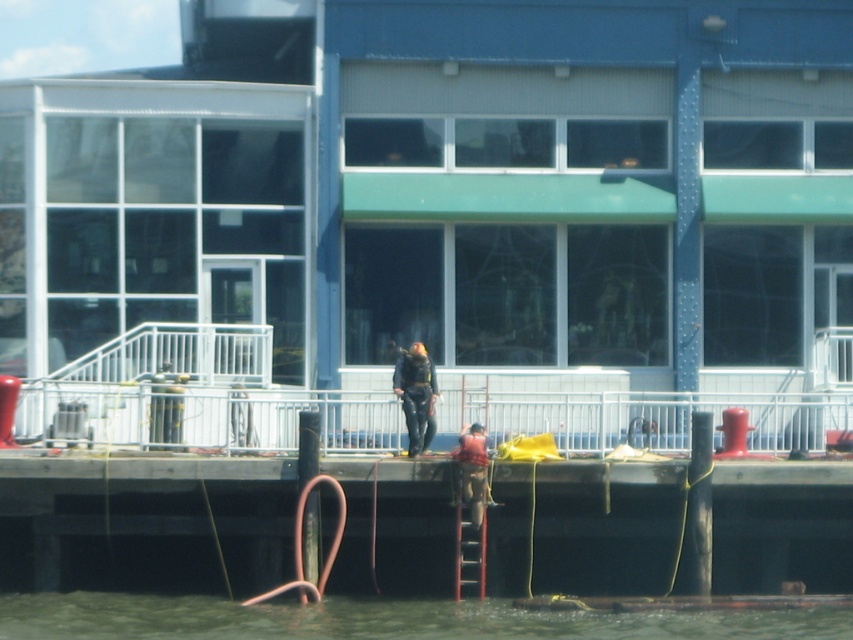
Is metallic red ladder at center above red plaid shirt at center?

No, metallic red ladder at center is not above red plaid shirt at center.

Who is more forward, (486, 499) or (461, 432)?

Point (486, 499)

Identify the location of metallic red ladder at center. (469, 509).

Does greenish water at lower center appear over red plaid shirt at center?

No, greenish water at lower center is not above red plaid shirt at center.

Which is in front, point (12, 628) or point (474, 502)?

Point (12, 628) is in front.

Find the location of a particular element. Image resolution: width=853 pixels, height=640 pixels. greenish water at lower center is located at coordinates (386, 620).

Does point (33, 381) lie behind point (128, 600)?

Yes.

Based on the photo, is white metal railing at center bigger than greenish water at lower center?

Incorrect, white metal railing at center is not larger than greenish water at lower center.

Between point (618, 410) and point (676, 621), which one is positioned in front?

Point (676, 621) is more forward.

Image resolution: width=853 pixels, height=640 pixels. I want to click on white metal railing at center, so click(202, 417).